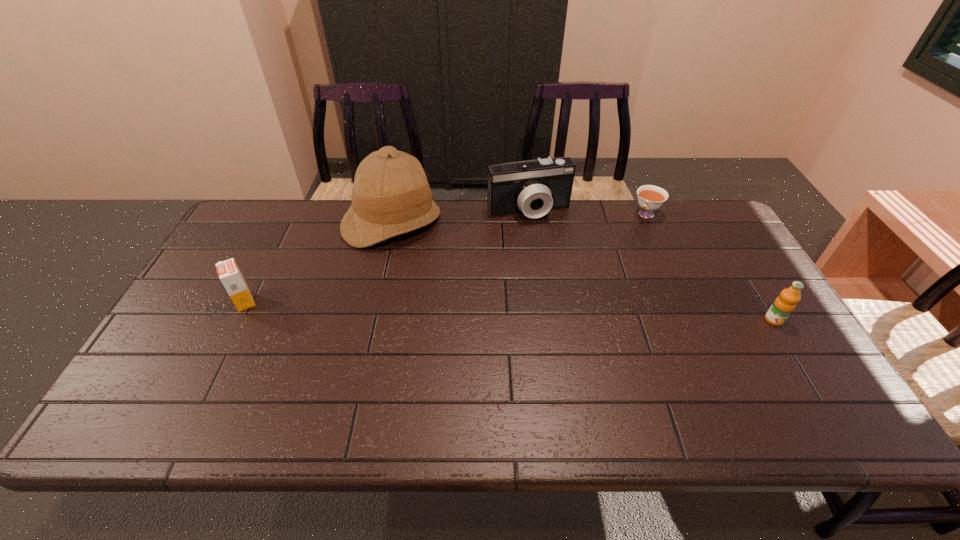
Identify the location of vacant region between the nearest object and the fourth shortest object. (651, 266).

Where is `free point between the fourth object from left to right and the leftmost object`? This screenshot has height=540, width=960. free point between the fourth object from left to right and the leftmost object is located at coordinates (445, 258).

Where is `object that is the second nearest to the fourth shortest object`? The image size is (960, 540). object that is the second nearest to the fourth shortest object is located at coordinates (650, 197).

Where is `object that stands as the fourth closest to the tallest object`? This screenshot has height=540, width=960. object that stands as the fourth closest to the tallest object is located at coordinates (784, 304).

Where is `vacant region that satisfies the following two spatial constraints: 1. on the back side of the second object from right to left; 2. on the right side of the leftmost object`? The width and height of the screenshot is (960, 540). vacant region that satisfies the following two spatial constraints: 1. on the back side of the second object from right to left; 2. on the right side of the leftmost object is located at coordinates (289, 214).

Locate an element on the screen. free spot that satisfies the following two spatial constraints: 1. on the back side of the shortest object; 2. on the right side of the farther orange juice is located at coordinates (289, 214).